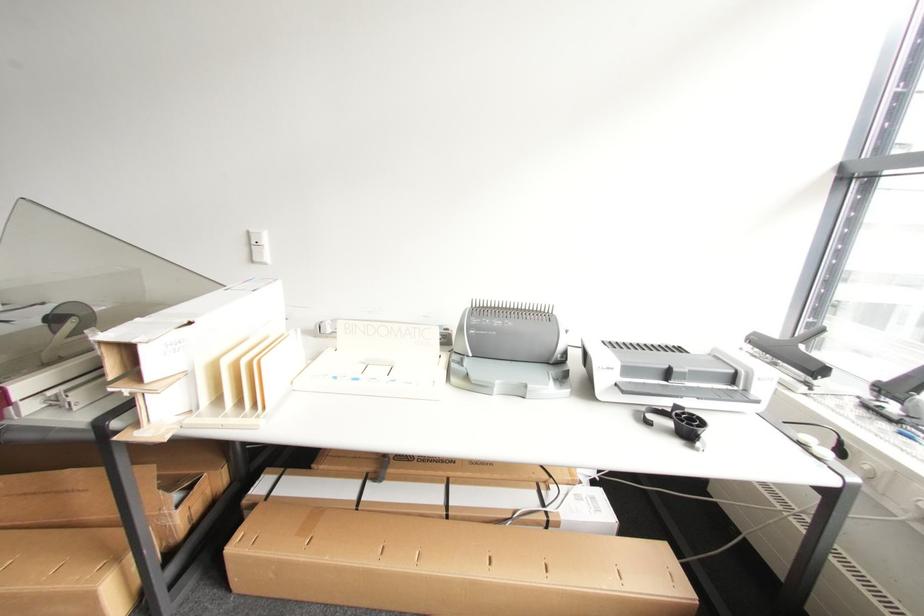
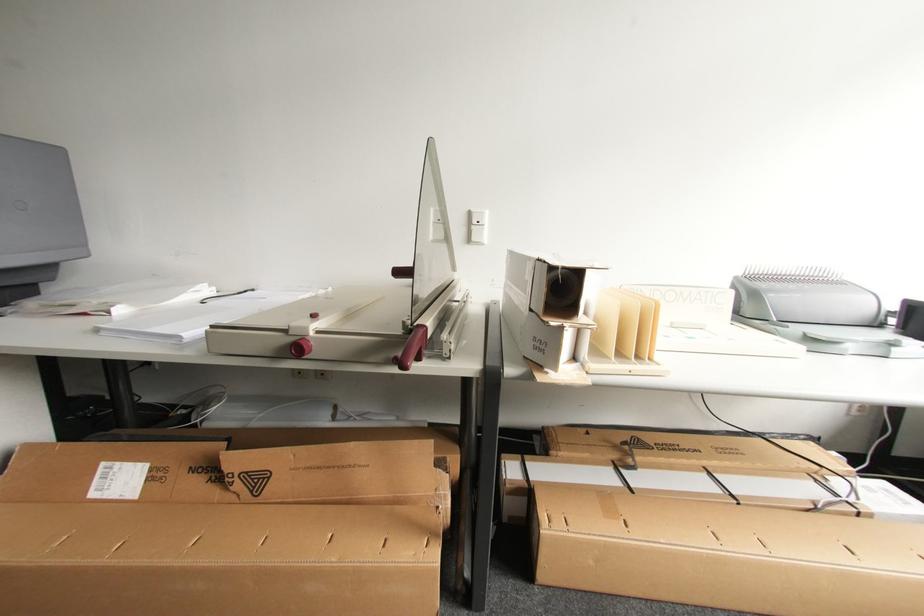
Question: The images are taken continuously from a first-person perspective. In which direction is your viewpoint rotating?

Choices:
 (A) Left
 (B) Right
 (C) Up
 (D) Down

Answer: (C)